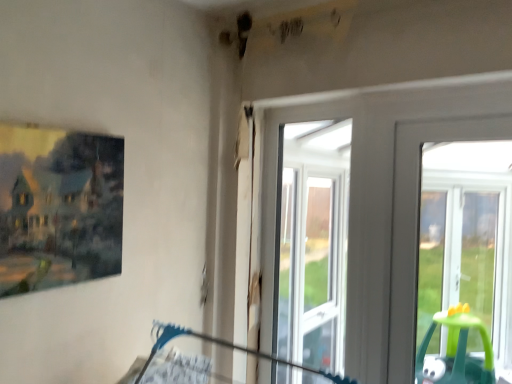
Question: From a real-world perspective, is matte wooden picture frame at left below clear glass window at center?

Choices:
 (A) no
 (B) yes

Answer: (A)

Question: Is matte wooden picture frame at left completely or partially outside of clear glass window at center?

Choices:
 (A) yes
 (B) no

Answer: (A)

Question: Is clear glass window at center surrounded by matte wooden picture frame at left?

Choices:
 (A) yes
 (B) no

Answer: (B)

Question: Is matte wooden picture frame at left taller than clear glass window at center?

Choices:
 (A) yes
 (B) no

Answer: (B)

Question: Is matte wooden picture frame at left next to clear glass window at center and touching it?

Choices:
 (A) yes
 (B) no

Answer: (B)

Question: Is matte wooden picture frame at left thinner than clear glass window at center?

Choices:
 (A) no
 (B) yes

Answer: (A)

Question: Is clear glass window at center to the left of matte wooden picture frame at left from the viewer's perspective?

Choices:
 (A) yes
 (B) no

Answer: (B)

Question: Is clear glass window at center further to the viewer compared to matte wooden picture frame at left?

Choices:
 (A) yes
 (B) no

Answer: (A)

Question: Can you see clear glass window at center touching matte wooden picture frame at left?

Choices:
 (A) no
 (B) yes

Answer: (A)

Question: From the image's perspective, would you say clear glass window at center is positioned over matte wooden picture frame at left?

Choices:
 (A) no
 (B) yes

Answer: (A)

Question: Could you tell me if clear glass window at center is turned towards matte wooden picture frame at left?

Choices:
 (A) yes
 (B) no

Answer: (A)

Question: Does clear glass window at center have a lesser width compared to matte wooden picture frame at left?

Choices:
 (A) no
 (B) yes

Answer: (B)

Question: In the image, is matte wooden picture frame at left positioned in front of or behind clear glass window at center?

Choices:
 (A) front
 (B) behind

Answer: (A)